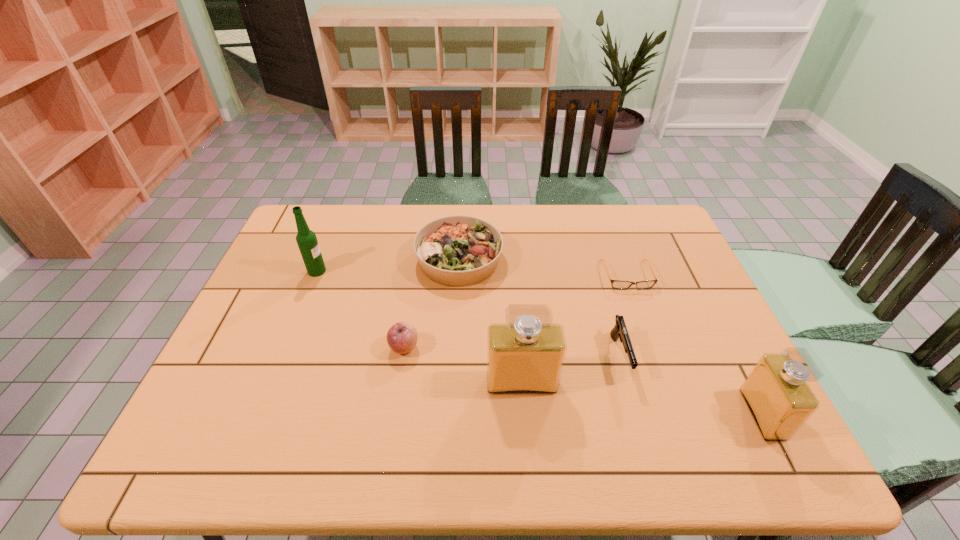
Where is `spectacles at the right edge`? This screenshot has width=960, height=540. spectacles at the right edge is located at coordinates (616, 284).

Locate an element on the screen. object positioned at the near right corner is located at coordinates (776, 392).

At what (x,y) coordinates should I click in order to perform the action: click on vacant space at the far edge of the desktop. Please return your answer as a coordinate pair (x, y). The height and width of the screenshot is (540, 960). Looking at the image, I should click on (447, 214).

Image resolution: width=960 pixels, height=540 pixels. In order to click on vacant space at the near edge of the desktop in this screenshot , I will do `click(486, 390)`.

In the image, there is a desktop. Identify the location of blank space at the left edge. The image size is (960, 540). (285, 298).

I want to click on vacant space at the right edge of the desktop, so click(708, 353).

The width and height of the screenshot is (960, 540). I want to click on vacant region at the far left corner of the desktop, so click(x=318, y=224).

Image resolution: width=960 pixels, height=540 pixels. In the image, there is a desktop. What are the coordinates of `vacant space at the near left corner` in the screenshot? It's located at (239, 394).

In the image, there is a desktop. At what (x,y) coordinates should I click in order to perform the action: click on free region at the far right corner. Please return your answer as a coordinate pair (x, y). The image size is (960, 540). Looking at the image, I should click on [673, 239].

Find the location of a particular element. free point between the rightmost object and the shortest object is located at coordinates (694, 345).